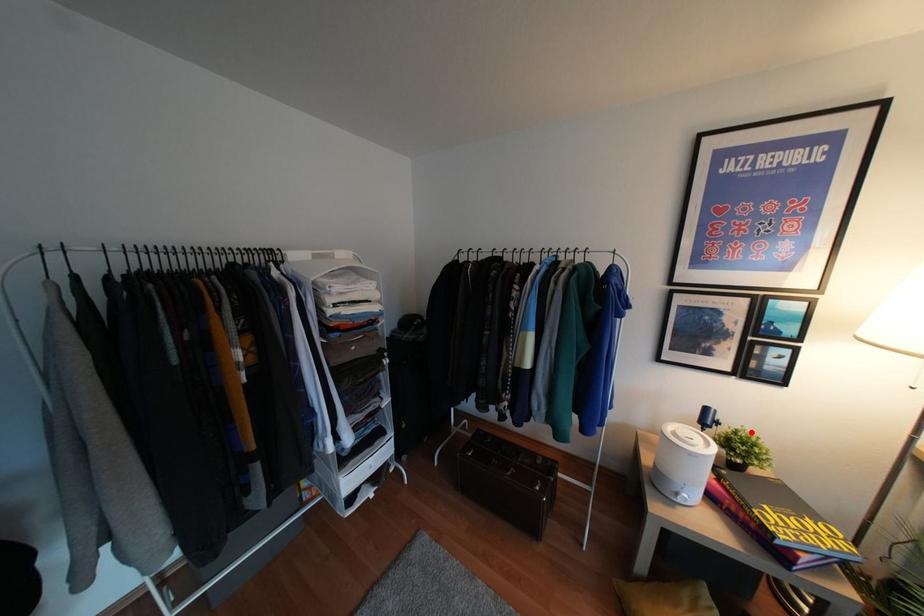
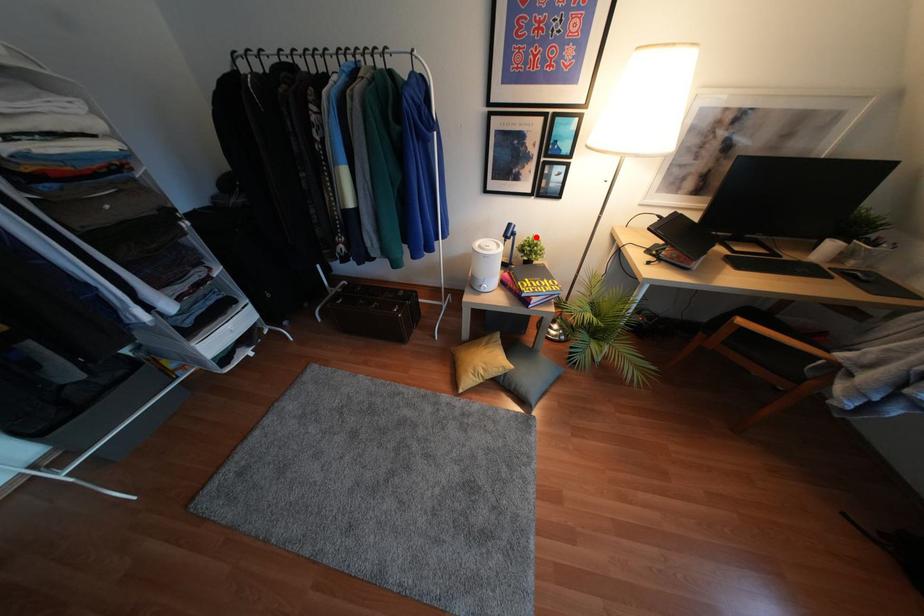
I am providing you with two images of the same scene from different viewpoints. A red point is marked on the first image and another point is marked on the second image. Is the marked point in image1 the same physical position as the marked point in image2?

Yes